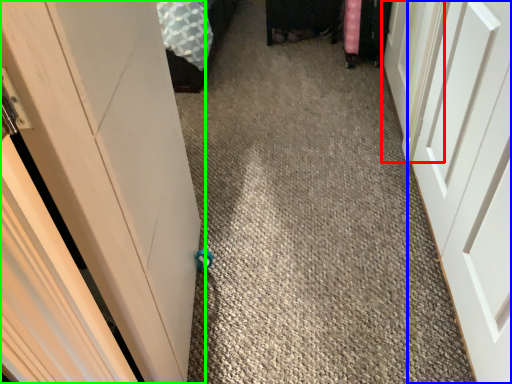
Question: Which object is the closest to the door (highlighted by a red box)? Choose among these: door (highlighted by a blue box) or door (highlighted by a green box).

Choices:
 (A) door
 (B) door

Answer: (A)